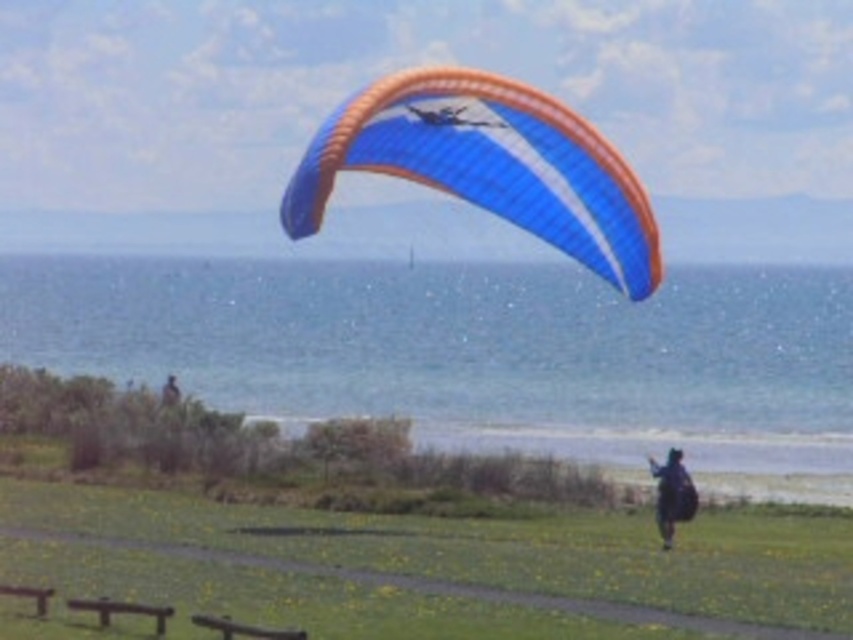
In order to click on blue fabric parachute at upper center in this screenshot , I will do `click(489, 164)`.

Who is more forward, (397, 125) or (674, 515)?

Positioned in front is point (674, 515).

Does point (498, 76) come farther from viewer compared to point (669, 490)?

That is False.

At what (x,y) coordinates should I click in order to perform the action: click on blue fabric parachute at upper center. Please return your answer as a coordinate pair (x, y). This screenshot has height=640, width=853. Looking at the image, I should click on (489, 164).

Between blue fabric parachute at upper center and dark blue fabric jacket at lower right, which one appears on the left side from the viewer's perspective?

Positioned to the left is dark blue fabric jacket at lower right.

I want to click on blue fabric parachute at upper center, so click(489, 164).

Does point (480, 180) lie behind point (164, 392)?

No.

I want to click on blue fabric parachute at upper center, so click(x=489, y=164).

How distant is green grassy field at lower center from blue fabric parachute at upper center?

25.37 feet

Can you confirm if green grassy field at lower center is positioned to the left of blue fabric parachute at upper center?

No, green grassy field at lower center is not to the left of blue fabric parachute at upper center.

Where is `green grassy field at lower center`? Image resolution: width=853 pixels, height=640 pixels. green grassy field at lower center is located at coordinates (416, 563).

The width and height of the screenshot is (853, 640). I want to click on green grassy field at lower center, so pos(416,563).